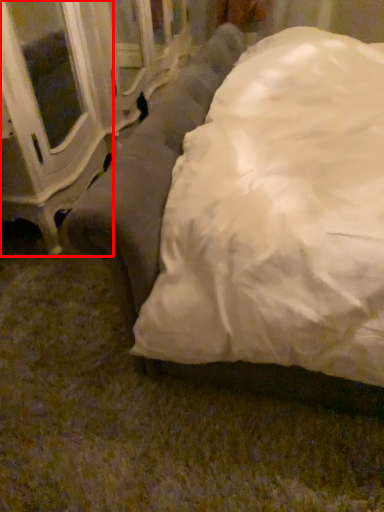
Question: From the image's perspective, where is furniture (annotated by the red box) located relative to studio couch?

Choices:
 (A) below
 (B) above

Answer: (B)